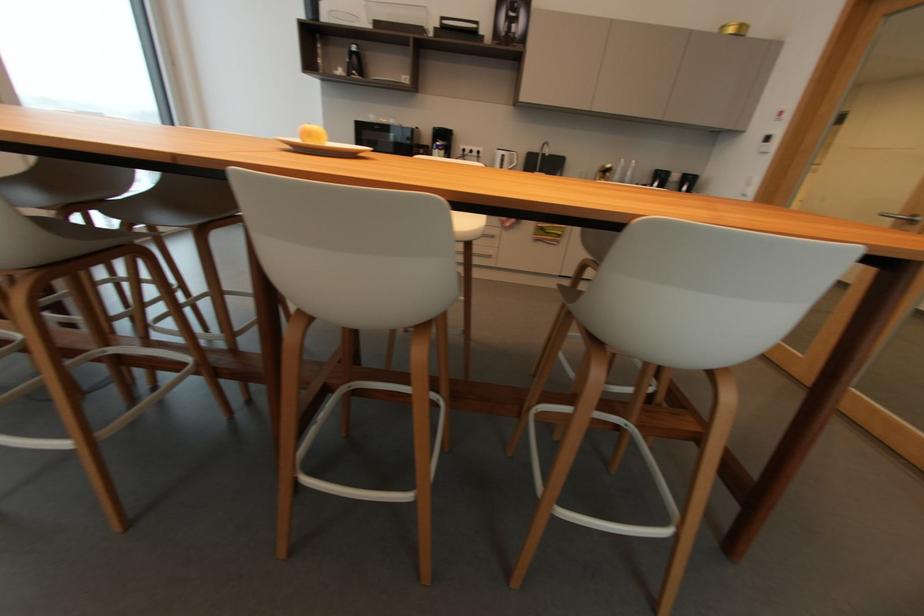
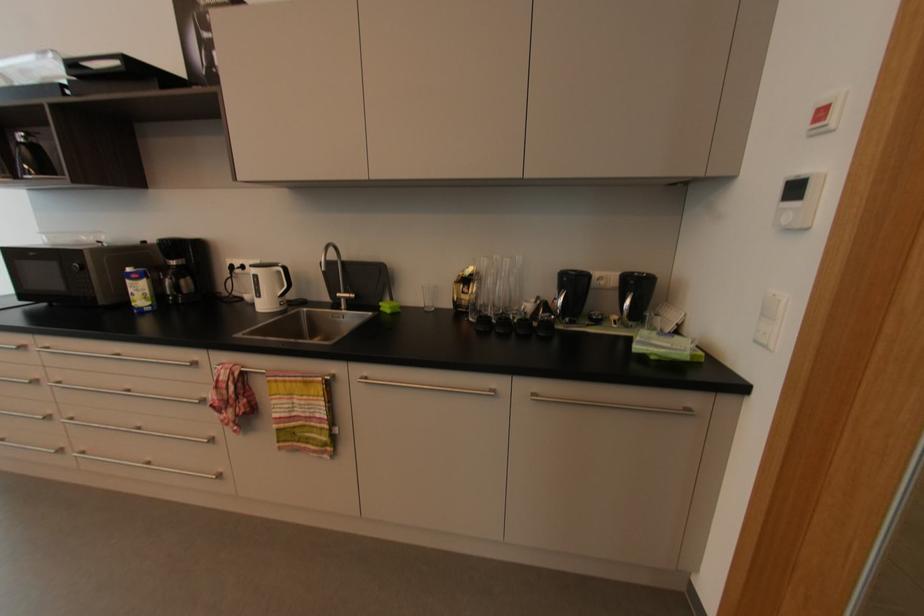
In the second image, find the point that corresponds to point (788, 108) in the first image.

(832, 99)